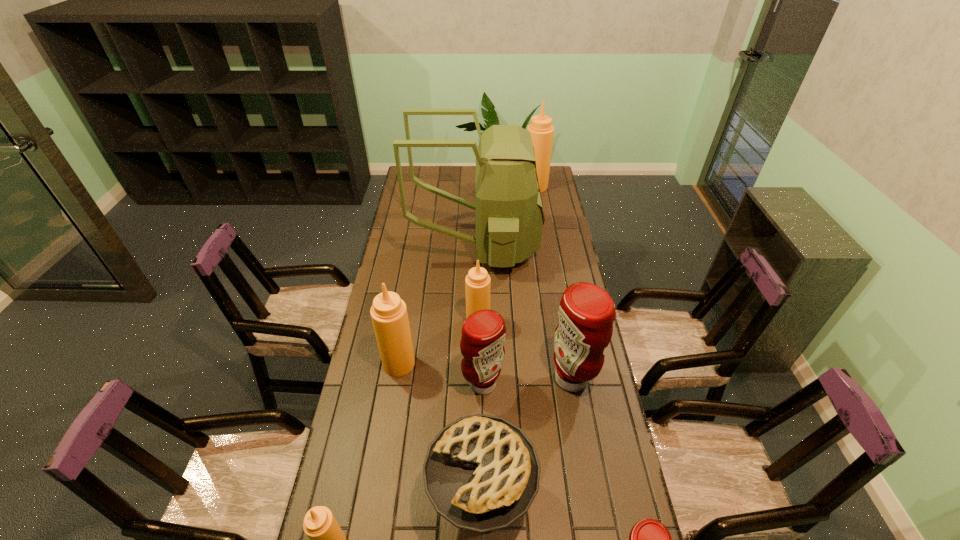
Identify which tan condiment is the fourth nearest to the leftmost red condiment. Please provide its 2D coordinates. Your answer should be formatted as a tuple, i.e. [(x, y)], where the tuple contains the x and y coordinates of a point satisfying the conditions above.

[(542, 131)]

This screenshot has height=540, width=960. In order to click on red condiment that can be found as the second closest to the biggest red condiment in this screenshot , I will do `click(649, 539)`.

Select which red condiment appears as the closest to the second farthest object. Please provide its 2D coordinates. Your answer should be formatted as a tuple, i.e. [(x, y)], where the tuple contains the x and y coordinates of a point satisfying the conditions above.

[(586, 312)]

In order to click on vacant space that satisfies the following two spatial constraints: 1. on the front side of the second smallest red condiment; 2. on the right side of the third farthest tan condiment in this screenshot , I will do click(x=396, y=383).